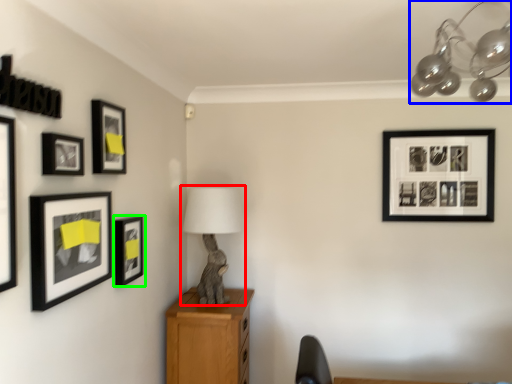
Question: Based on their relative distances, which object is nearer to table lamp (highlighted by a red box)? Choose from lamp (highlighted by a blue box) and picture frame (highlighted by a green box).

Choices:
 (A) lamp
 (B) picture frame

Answer: (B)